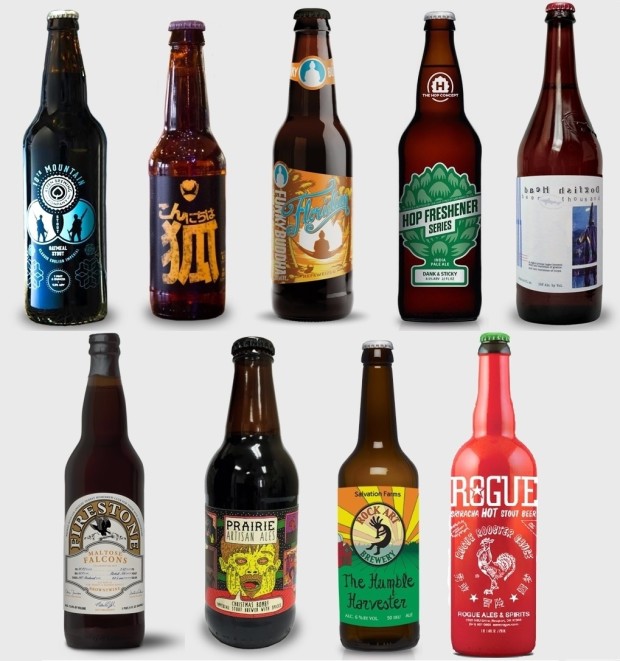
Identify the location of main beer glass body. The width and height of the screenshot is (620, 661). (66, 143), (195, 151), (320, 155), (449, 147), (583, 158), (505, 455), (392, 476), (267, 484), (99, 481).